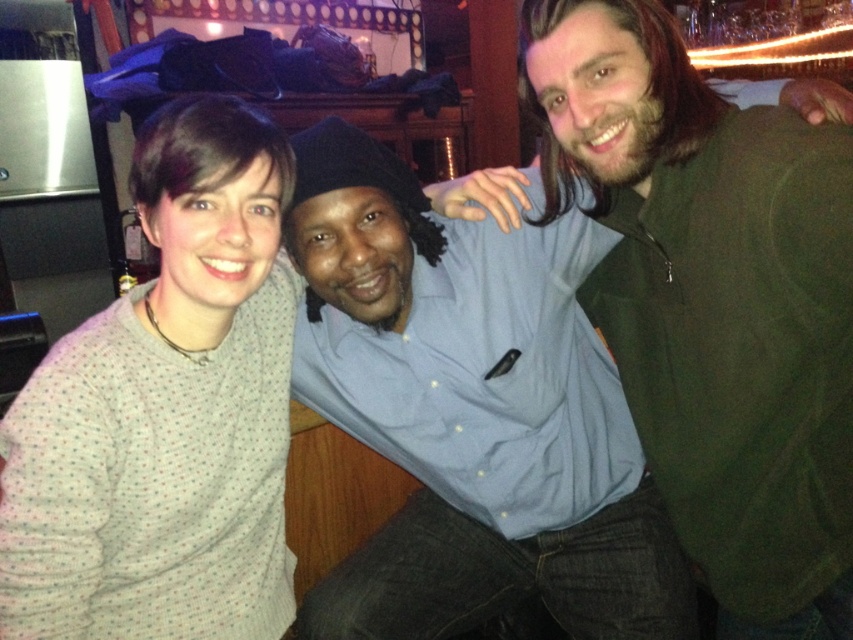
You are a photographer taking a picture of the group. You notice the green matte jacket at right and the white dotted sweater at left. Which one is closer to the camera?

The green matte jacket at right is closer to the camera because it is in front of the white dotted sweater at left.

You are a photographer setting up for a group photo. You need to ensure that all three people fit within the frame. The camera has a fixed width that can only accommodate objects up to the width of the green matte jacket at right. Will the white dotted sweater at left fit within this width?

The green matte jacket at right is wider than the white dotted sweater at left. Since the camera can accommodate up to the width of the green matte jacket at right, the white dotted sweater at left will fit within this width.